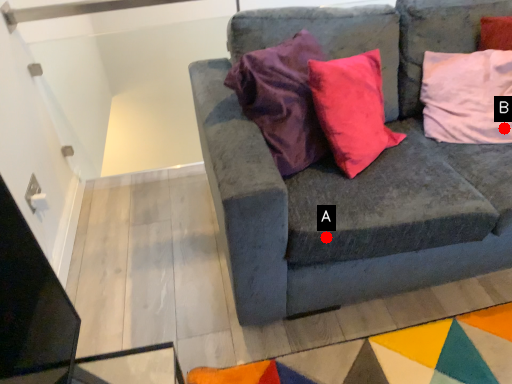
Question: Two points are circled on the image, labeled by A and B beside each circle. Which point is closer to the camera?

Choices:
 (A) A is closer
 (B) B is closer

Answer: (A)